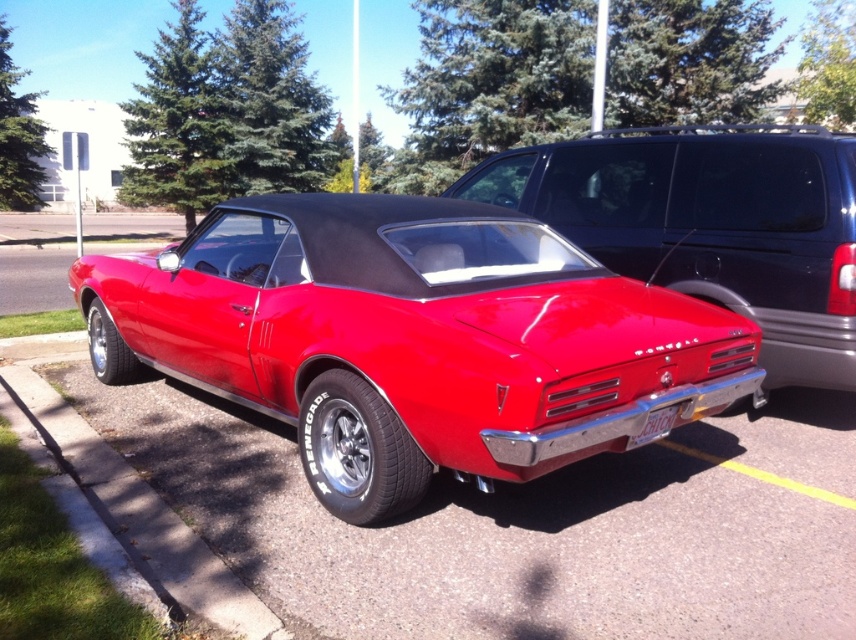
Does shiny red car at center come in front of white plastic license plate at rear?

Yes, it is in front of white plastic license plate at rear.

Is point (522, 381) positioned after point (658, 438)?

No, it is not.

Find the location of a particular element. shiny red car at center is located at coordinates (411, 339).

Does shiny red car at center have a greater width compared to glossy black suv at upper right?

Yes.

Where is `shiny red car at center`? This screenshot has width=856, height=640. shiny red car at center is located at coordinates (411, 339).

Identify the location of glossy black suv at upper right. (710, 225).

What do you see at coordinates (710, 225) in the screenshot? I see `glossy black suv at upper right` at bounding box center [710, 225].

This screenshot has width=856, height=640. What do you see at coordinates (710, 225) in the screenshot? I see `glossy black suv at upper right` at bounding box center [710, 225].

Where is `glossy black suv at upper right`? The image size is (856, 640). glossy black suv at upper right is located at coordinates (710, 225).